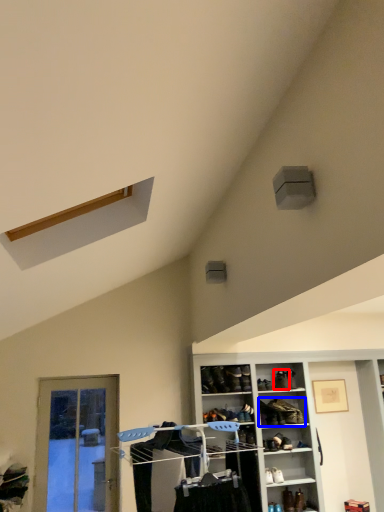
Question: Which object appears closest to the camera in this image, shoe (highlighted by a red box) or footwear (highlighted by a blue box)?

Choices:
 (A) shoe
 (B) footwear

Answer: (B)